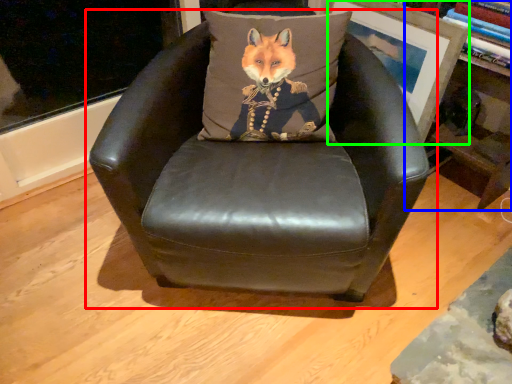
Question: Which object is positioned farthest from chair (highlighted by a red box)? Select from bookshelf (highlighted by a blue box) and picture frame (highlighted by a green box).

Choices:
 (A) bookshelf
 (B) picture frame

Answer: (A)